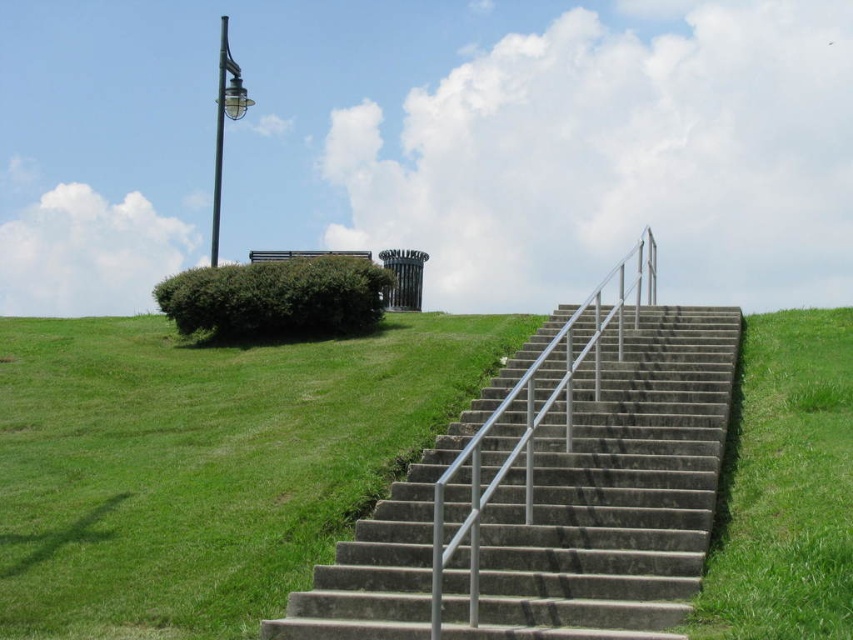
You are standing at the bottom of the stairs and want to place a small potted plant exactly at the point with coordinates point (610, 493). Since the stairs are made of concrete, you need to check if the point is on the stairs. Is the point on the stairs?

The point (610, 493) is on the concrete stairs at center, so yes, you can place the potted plant there as it is on the stairs.

You are a gardener who needs to water the green grass at lower left and the green leafy bush at upper left. The water hose you have can only reach 15 feet. Can you water both areas without moving the hose? Please explain your reasoning.

The green grass at lower left is 17.95 feet away from the green leafy bush at upper left. Since the hose can only reach 15 feet, it is not long enough to cover the distance between them. Therefore, you cannot water both areas without moving the hose.